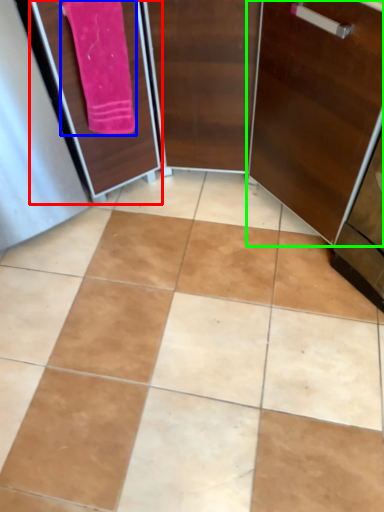
Question: Which object is the farthest from screen door (highlighted by a red box)? Choose among these: bath towel (highlighted by a blue box) or door (highlighted by a green box).

Choices:
 (A) bath towel
 (B) door

Answer: (B)